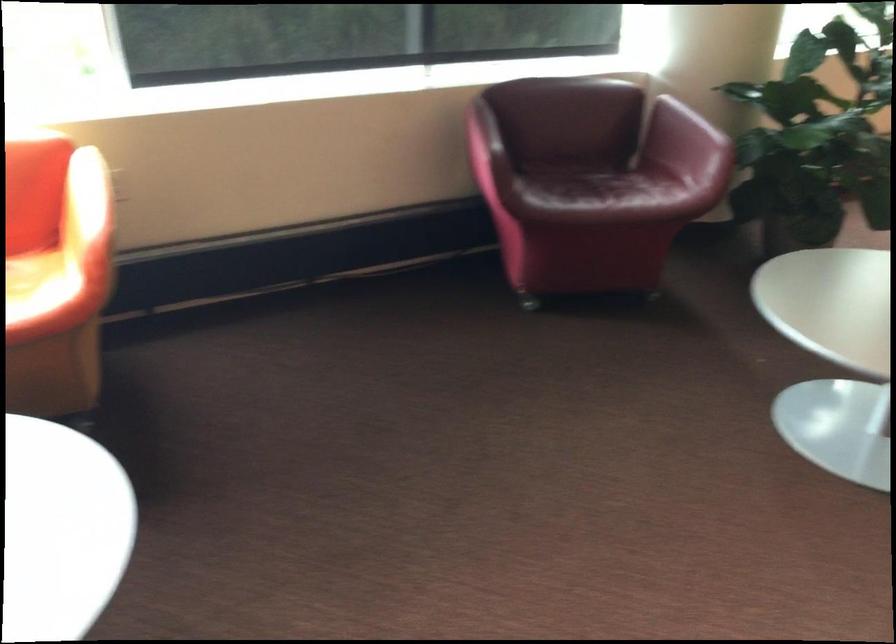
Find the location of a particular element. Image resolution: width=896 pixels, height=644 pixels. orange chair armrest is located at coordinates (85, 200).